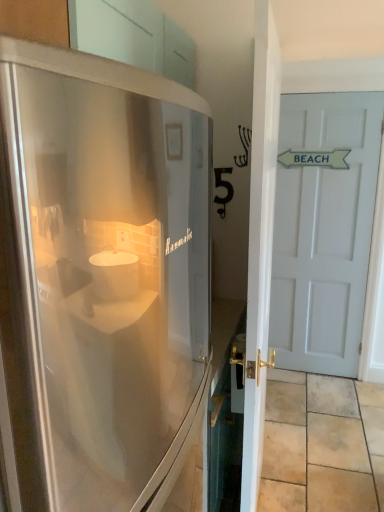
Question: In the image, is stainless steel refrigerator at left on the left side or the right side of white glossy door at right, which appears as the second door when viewed from the right?

Choices:
 (A) left
 (B) right

Answer: (A)

Question: Is stainless steel refrigerator at left inside the boundaries of white glossy door at right, which appears as the second door when viewed from the right, or outside?

Choices:
 (A) inside
 (B) outside

Answer: (B)

Question: Estimate the real-world distances between objects in this image. Which object is farther from the white matte door at right, which is the 2th door in left-to-right order?

Choices:
 (A) stainless steel refrigerator at left
 (B) white glossy door at right, the first door positioned from the left
 (C) beige stone tile at lower right

Answer: (B)

Question: Considering the real-world distances, which object is closest to the white matte door at right, which ranks as the 1th door in right-to-left order?

Choices:
 (A) beige stone tile at lower right
 (B) white glossy door at right, which appears as the second door when viewed from the right
 (C) stainless steel refrigerator at left

Answer: (A)